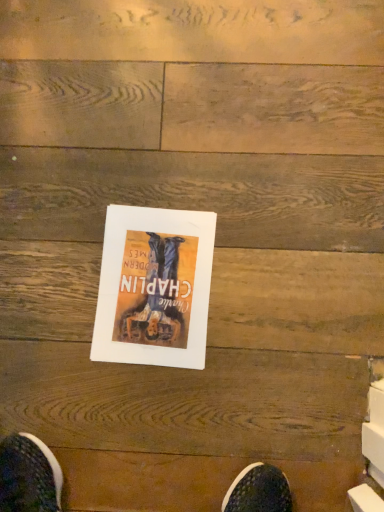
The width and height of the screenshot is (384, 512). What do you see at coordinates (154, 287) in the screenshot?
I see `white paper at center` at bounding box center [154, 287].

This screenshot has width=384, height=512. I want to click on white paper at center, so click(154, 287).

Where is `white paper at center`? This screenshot has width=384, height=512. white paper at center is located at coordinates (154, 287).